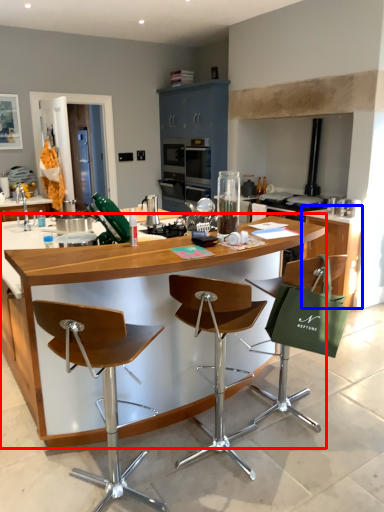
Question: Among these objects, which one is nearest to the camera, table (highlighted by a red box) or cabinetry (highlighted by a blue box)?

Choices:
 (A) table
 (B) cabinetry

Answer: (A)